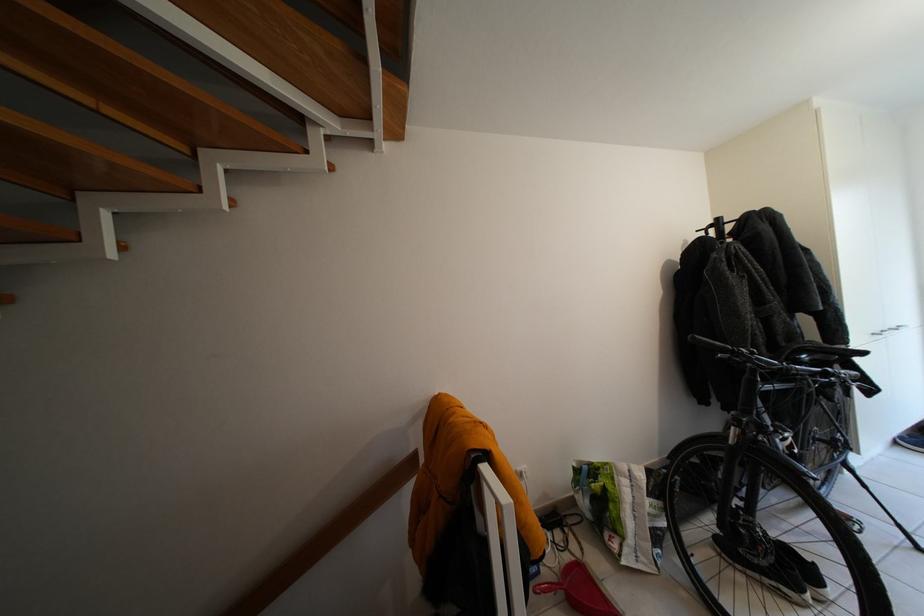
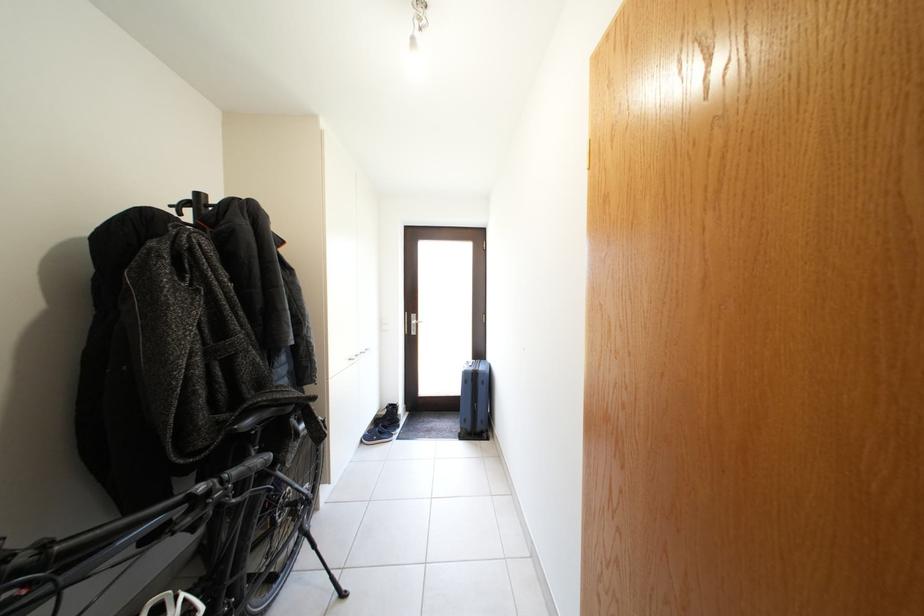
In the second image, find the point that corresponds to [726,225] in the first image.

(205, 200)